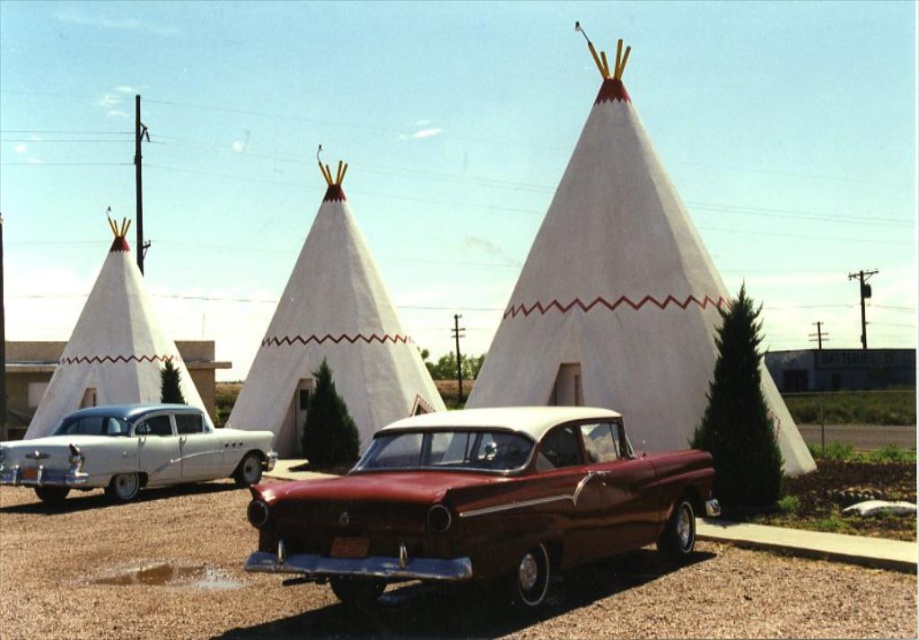
You are a photographer standing in front of the white canvas teepee at center and the white glossy sedan at left. You want to capture a photo where both objects are visible. Which object should you position closer to the camera to ensure both are in frame without moving the camera?

The white canvas teepee at center is above the white glossy sedan at left, so positioning the white canvas teepee at center closer to the camera will ensure both are in frame without moving the camera.

You are standing at the entrance of the teepees and want to walk to the vintage cars. Which point should you head towards first, point (622, 301) or point (377, 374), to reach the cars more directly?

You should head towards point (622, 301) first because it is in front of point (377, 374), meaning it is closer to the entrance of the teepees and thus more directly towards the vintage cars.

You are standing at the entrance of the teepees and want to take a photo of the vintage cars. Which point, point [343,273] or point [54,403], is closer to the teepees?

Point [343,273] is closer to the teepees because it is in front of point [54,403], which is further away.